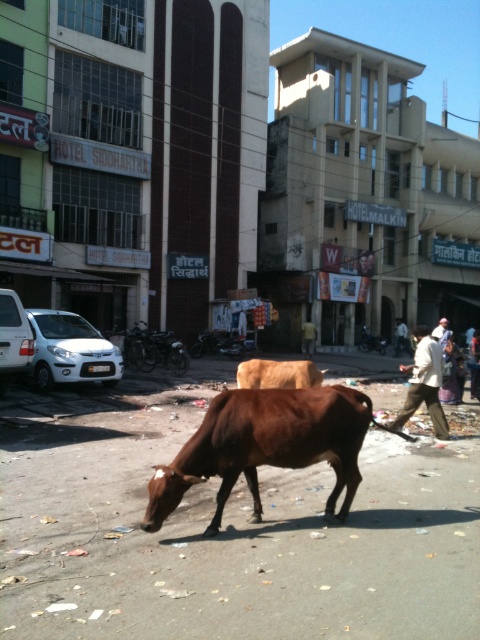
Question: Which of the following is the closest to the observer?

Choices:
 (A) light beige pants at center
 (B) brown matte bull at center

Answer: (B)

Question: Is brown matte bull at center closer to camera compared to light beige pants at center?

Choices:
 (A) yes
 (B) no

Answer: (A)

Question: Can you confirm if brown matte bull at center is bigger than light beige pants at center?

Choices:
 (A) yes
 (B) no

Answer: (B)

Question: Which point is farther to the camera?

Choices:
 (A) (441, 417)
 (B) (294, 410)

Answer: (A)

Question: Is brown matte bull at center positioned behind light beige pants at center?

Choices:
 (A) yes
 (B) no

Answer: (B)